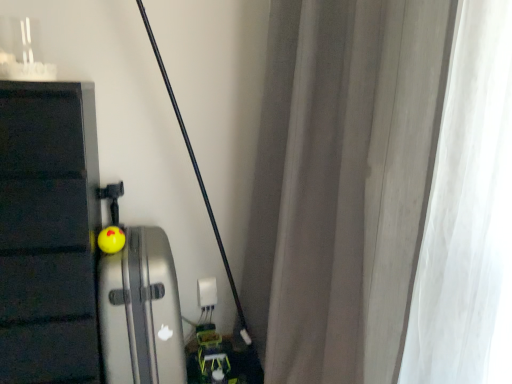
Question: Does white plastic electric outlet at center appear on the right side of white sheer curtain at right?

Choices:
 (A) yes
 (B) no

Answer: (B)

Question: From the image's perspective, does white plastic electric outlet at center appear higher than white sheer curtain at right?

Choices:
 (A) yes
 (B) no

Answer: (B)

Question: Is white plastic electric outlet at center aimed at white sheer curtain at right?

Choices:
 (A) no
 (B) yes

Answer: (A)

Question: Does white plastic electric outlet at center have a lesser height compared to white sheer curtain at right?

Choices:
 (A) yes
 (B) no

Answer: (A)

Question: Considering the relative sizes of white plastic electric outlet at center and white sheer curtain at right in the image provided, is white plastic electric outlet at center smaller than white sheer curtain at right?

Choices:
 (A) no
 (B) yes

Answer: (B)

Question: Does point (148, 294) appear closer or farther from the camera than point (436, 223)?

Choices:
 (A) closer
 (B) farther

Answer: (B)

Question: Is silver metallic suitcase at left wider or thinner than white sheer curtain at right?

Choices:
 (A) wide
 (B) thin

Answer: (A)

Question: Would you say silver metallic suitcase at left is inside or outside white sheer curtain at right?

Choices:
 (A) inside
 (B) outside

Answer: (B)

Question: Is silver metallic suitcase at left to the left or to the right of white sheer curtain at right in the image?

Choices:
 (A) left
 (B) right

Answer: (A)

Question: In the image, is yellow rubber ball at center positioned in front of or behind silver metallic suitcase at left?

Choices:
 (A) front
 (B) behind

Answer: (B)

Question: Considering the positions of point (109, 241) and point (123, 266), is point (109, 241) closer or farther from the camera than point (123, 266)?

Choices:
 (A) farther
 (B) closer

Answer: (A)

Question: Is yellow rubber ball at center taller or shorter than silver metallic suitcase at left?

Choices:
 (A) short
 (B) tall

Answer: (A)

Question: Considering the positions of yellow rubber ball at center and silver metallic suitcase at left in the image, is yellow rubber ball at center wider or thinner than silver metallic suitcase at left?

Choices:
 (A) wide
 (B) thin

Answer: (B)

Question: Is white plastic electric outlet at center wider or thinner than white sheer curtain at right?

Choices:
 (A) wide
 (B) thin

Answer: (B)

Question: From the image's perspective, is white plastic electric outlet at center positioned above or below white sheer curtain at right?

Choices:
 (A) above
 (B) below

Answer: (B)